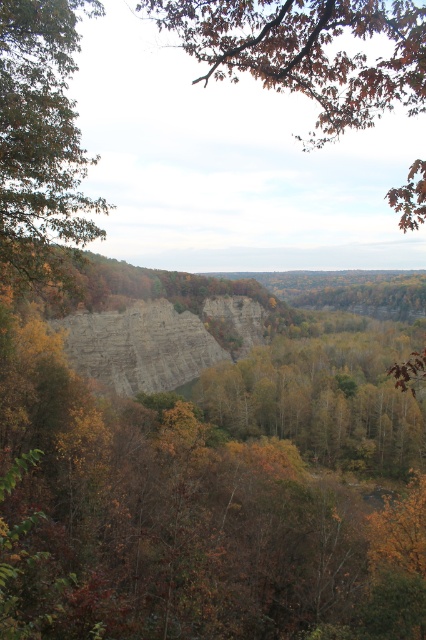
You are an observer standing in the forest looking at the scene. Which object is higher up in the image, the brown leafy branch at upper center or the brown matte tree at left?

The brown leafy branch at upper center is positioned over the brown matte tree at left, meaning it is higher up in the image.

You are standing in the forest scene. There is a point marked at coordinates (307,51). Based on the scene description, can you determine what object this point is located on?

The point is located on the brown leafy branch at upper center.

You are standing at the center of the image and want to locate the brown matte tree at left. Based on the coordinates provided, in which direction should you look to find it?

The brown matte tree at left is located at coordinates point (40, 140), which means it is positioned to the left and slightly above the center of the image. To locate it, you should look to the left and slightly upwards from the center point.